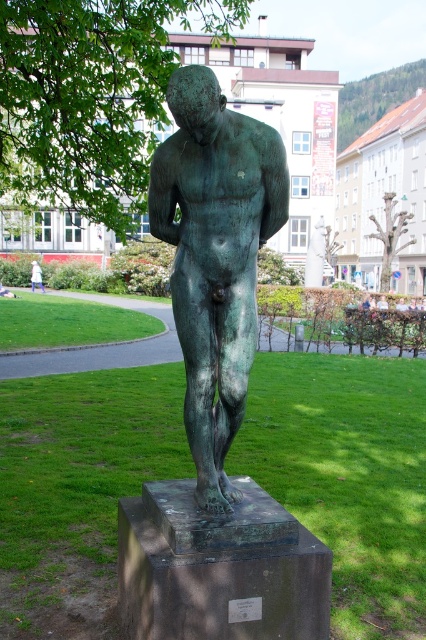
Measure the distance between point (379, 236) and camera.

39.57 meters

Does green textured tree at center have a greater height compared to white cotton shirt at lower left?

Indeed, green textured tree at center has a greater height compared to white cotton shirt at lower left.

At what (x,y) coordinates should I click in order to perform the action: click on green textured tree at center. Please return your answer as a coordinate pair (x, y). The width and height of the screenshot is (426, 640). Looking at the image, I should click on (389, 236).

The width and height of the screenshot is (426, 640). Find the location of `green textured tree at center`. green textured tree at center is located at coordinates point(389,236).

Is green patina statue at center closer to the viewer compared to green textured tree at center?

Yes, it is.

Does green patina statue at center appear over green textured tree at center?

Actually, green patina statue at center is below green textured tree at center.

I want to click on green patina statue at center, so coord(348,476).

Between green patina bronze statue at center and white cotton shirt at lower left, which one appears on the left side from the viewer's perspective?

From the viewer's perspective, white cotton shirt at lower left appears more on the left side.

Does green patina bronze statue at center appear on the left side of white cotton shirt at lower left?

No, green patina bronze statue at center is not to the left of white cotton shirt at lower left.

Is point (201, 148) positioned after point (34, 284)?

No, it is in front of (34, 284).

Where is `green patina bronze statue at center`? green patina bronze statue at center is located at coordinates (215, 257).